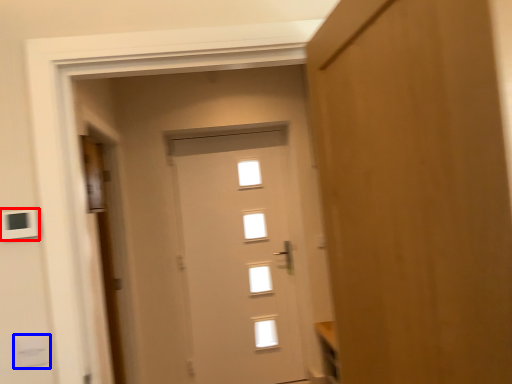
Question: Which point is further to the camera, light switch (highlighted by a red box) or light switch (highlighted by a blue box)?

Choices:
 (A) light switch
 (B) light switch

Answer: (B)